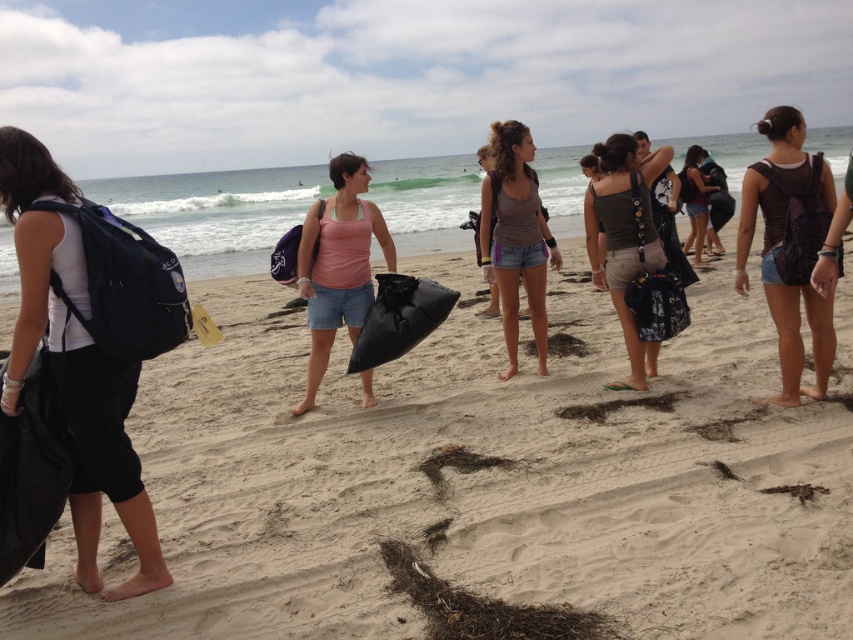
Question: Which object is closer to the camera taking this photo?

Choices:
 (A) matte black backpack at left
 (B) matte brown tank top at center
 (C) black fabric bag at center

Answer: (A)

Question: Can you confirm if black fabric bag at center is positioned above pink fabric tank top at center?

Choices:
 (A) yes
 (B) no

Answer: (B)

Question: Does black fabric bag at center have a greater width compared to black plastic bag at center?

Choices:
 (A) no
 (B) yes

Answer: (A)

Question: Which of these objects is positioned closest to the matte black backpack at left?

Choices:
 (A) pink fabric tank top at center
 (B) black fabric bag at center
 (C) matte black backpack at center

Answer: (A)

Question: Observing the image, what is the correct spatial positioning of pink fabric tank top at center in reference to matte green tank top at center?

Choices:
 (A) above
 (B) below

Answer: (B)

Question: Among these objects, which one is nearest to the camera?

Choices:
 (A) matte brown tank top at center
 (B) matte black backpack at center
 (C) black plastic bag at center

Answer: (A)